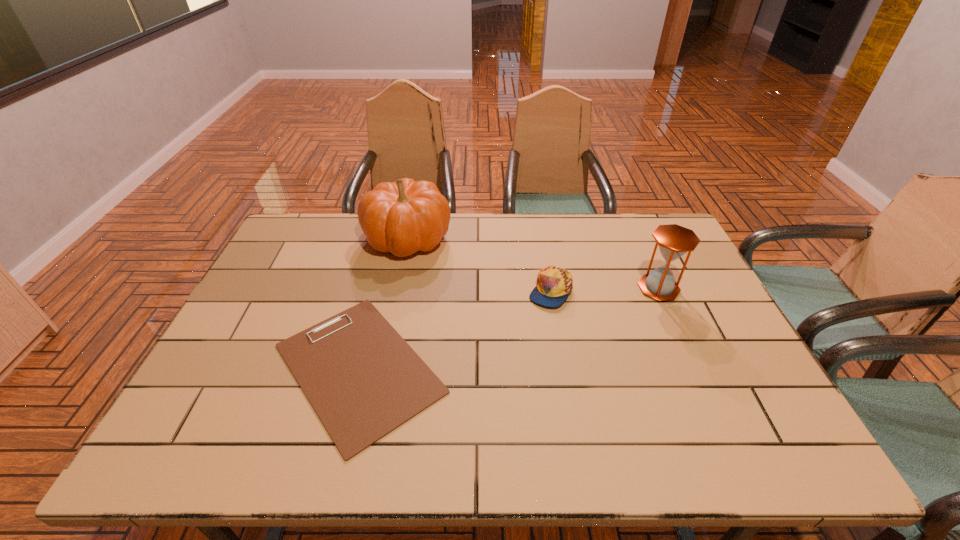
Locate an element on the screen. This screenshot has height=540, width=960. object that is the closest one to the shortest object is located at coordinates point(406,216).

The width and height of the screenshot is (960, 540). I want to click on object that is the closest to the hourglass, so click(x=554, y=284).

The image size is (960, 540). In order to click on free space that satisfies the following two spatial constraints: 1. on the front side of the farthest object; 2. on the left side of the rightmost object in this screenshot , I will do `click(396, 288)`.

Where is `free space in the image that satisfies the following two spatial constraints: 1. on the back side of the shortest object; 2. on the right side of the hourglass`? free space in the image that satisfies the following two spatial constraints: 1. on the back side of the shortest object; 2. on the right side of the hourglass is located at coordinates (379, 288).